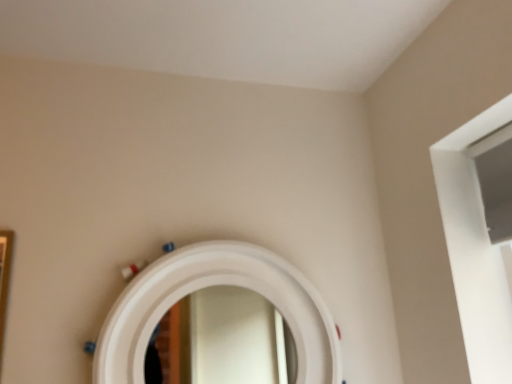
This screenshot has height=384, width=512. What do you see at coordinates (4, 280) in the screenshot? I see `gold metallic picture frame at left` at bounding box center [4, 280].

Find the location of a particular element. This screenshot has width=512, height=384. gold metallic picture frame at left is located at coordinates (x=4, y=280).

Describe the element at coordinates (210, 286) in the screenshot. The height and width of the screenshot is (384, 512). I see `white glossy mirror at center` at that location.

Locate an element on the screen. The width and height of the screenshot is (512, 384). white glossy mirror at center is located at coordinates (210, 286).

This screenshot has width=512, height=384. What are the coordinates of `gold metallic picture frame at left` in the screenshot? It's located at pyautogui.click(x=4, y=280).

Between gold metallic picture frame at left and white glossy mirror at center, which one appears on the left side from the viewer's perspective?

Positioned to the left is gold metallic picture frame at left.

Is gold metallic picture frame at left further to camera compared to white glossy mirror at center?

No, gold metallic picture frame at left is closer to the viewer.

Between point (5, 292) and point (134, 356), which one is positioned in front?

The point (5, 292) is closer.

From the image's perspective, is gold metallic picture frame at left below white glossy mirror at center?

Incorrect, from the image's perspective, gold metallic picture frame at left is higher than white glossy mirror at center.

In the scene shown: From a real-world perspective, is gold metallic picture frame at left physically below white glossy mirror at center?

Yes.

Can you confirm if gold metallic picture frame at left is wider than white glossy mirror at center?

In fact, gold metallic picture frame at left might be narrower than white glossy mirror at center.

Does gold metallic picture frame at left have a greater height compared to white glossy mirror at center?

Yes.

Who is smaller, gold metallic picture frame at left or white glossy mirror at center?

Smaller between the two is gold metallic picture frame at left.

Is gold metallic picture frame at left inside the boundaries of white glossy mirror at center, or outside?

gold metallic picture frame at left is located beyond the bounds of white glossy mirror at center.

Is gold metallic picture frame at left beside white glossy mirror at center?

No, gold metallic picture frame at left is not beside white glossy mirror at center.

Is gold metallic picture frame at left positioned with its back to white glossy mirror at center?

Result: No.

How many degrees apart are the facing directions of gold metallic picture frame at left and white glossy mirror at center?

The angular difference between gold metallic picture frame at left and white glossy mirror at center is 0.141 degrees.

Find the location of a particular element. The image size is (512, 384). picture frame in front of the white glossy mirror at center is located at coordinates click(4, 280).

Based on their positions, is white glossy mirror at center located to the left or right of gold metallic picture frame at left?

From the image, it's evident that white glossy mirror at center is to the right of gold metallic picture frame at left.

Is white glossy mirror at center in front of gold metallic picture frame at left?

No, it is not.

Is point (141, 280) farther from camera compared to point (3, 295)?

Yes, it is behind point (3, 295).

From the picture: From the image's perspective, between white glossy mirror at center and gold metallic picture frame at left, who is located below?

white glossy mirror at center appears lower in the image.

From a real-world perspective, who is located higher, white glossy mirror at center or gold metallic picture frame at left?

white glossy mirror at center.

Can you confirm if white glossy mirror at center is thinner than gold metallic picture frame at left?

In fact, white glossy mirror at center might be wider than gold metallic picture frame at left.

Is white glossy mirror at center shorter than gold metallic picture frame at left?

Yes.

Which of these two, white glossy mirror at center or gold metallic picture frame at left, is bigger?

With larger size is white glossy mirror at center.

Would you say gold metallic picture frame at left is part of white glossy mirror at center's contents?

No, gold metallic picture frame at left is located outside of white glossy mirror at center.

Is white glossy mirror at center placed right next to gold metallic picture frame at left?

No, white glossy mirror at center is not with gold metallic picture frame at left.

Is white glossy mirror at center oriented towards gold metallic picture frame at left?

No, white glossy mirror at center is not aimed at gold metallic picture frame at left.

How different are the orientations of white glossy mirror at center and gold metallic picture frame at left in degrees?

The angular difference between white glossy mirror at center and gold metallic picture frame at left is 0.141 degrees.

This screenshot has height=384, width=512. In the image, there is a white glossy mirror at center. In order to click on picture frame below it (from a real-world perspective) in this screenshot , I will do `click(4, 280)`.

This screenshot has width=512, height=384. What are the coordinates of `picture frame in front of the white glossy mirror at center` in the screenshot? It's located at (4, 280).

The image size is (512, 384). Find the location of `mirror below the gold metallic picture frame at left (from the image's perspective)`. mirror below the gold metallic picture frame at left (from the image's perspective) is located at coordinates click(210, 286).